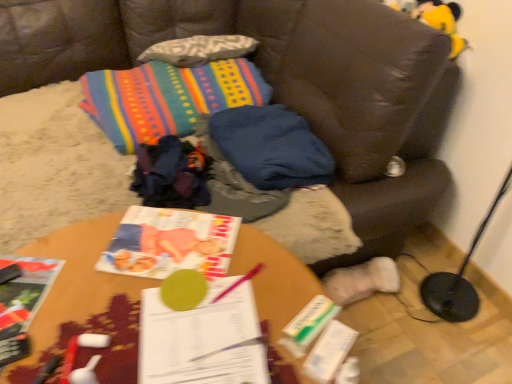
Question: From a real-world perspective, is matte paper book at center, which is counted as the 2th book, starting from the right, above or below white paper book at center, which is the first book in right-to-left order?

Choices:
 (A) below
 (B) above

Answer: (A)

Question: In terms of width, does matte paper book at center, which is counted as the 2th book, starting from the right, look wider or thinner when compared to white paper book at center, which is the first book in right-to-left order?

Choices:
 (A) thin
 (B) wide

Answer: (B)

Question: Considering the real-world distances, which object is farthest from the brown leather couch at center?

Choices:
 (A) matte paper book at center, the second book viewed from the left
 (B) yellow plush toy at upper right
 (C) white paper book at center, which is the first book in right-to-left order
 (D) hardcover book at lower left, the third book from the right
 (E) blue fabric pillow at center

Answer: (D)

Question: Which object is positioned farthest from the yellow plush toy at upper right?

Choices:
 (A) matte paper book at center, the second book viewed from the left
 (B) wooden table at center
 (C) white paper book at center, the 3th book positioned from the left
 (D) blue fabric pillow at center
 (E) brown leather couch at center

Answer: (C)